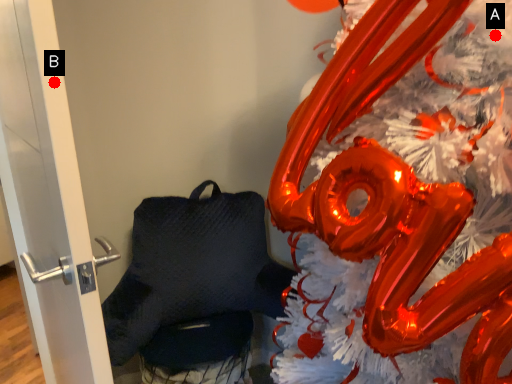
Question: Two points are circled on the image, labeled by A and B beside each circle. Which point is closer to the camera taking this photo?

Choices:
 (A) A is closer
 (B) B is closer

Answer: (B)